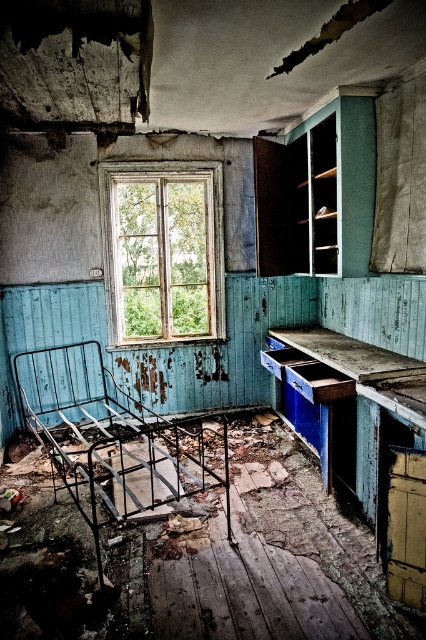
Question: Which point appears farthest from the camera in this image?

Choices:
 (A) (29, 362)
 (B) (175, 216)

Answer: (B)

Question: Which of the following is the farthest from the observer?

Choices:
 (A) [x=195, y=198]
 (B) [x=157, y=442]

Answer: (A)

Question: Can you confirm if rusty metal bed at lower left is bigger than wooden window at center?

Choices:
 (A) no
 (B) yes

Answer: (B)

Question: Does rusty metal bed at lower left appear under wooden window at center?

Choices:
 (A) yes
 (B) no

Answer: (A)

Question: Can you confirm if rusty metal bed at lower left is positioned below wooden window at center?

Choices:
 (A) yes
 (B) no

Answer: (A)

Question: Which point is closer to the camera taking this photo?

Choices:
 (A) (101, 188)
 (B) (63, 390)

Answer: (A)